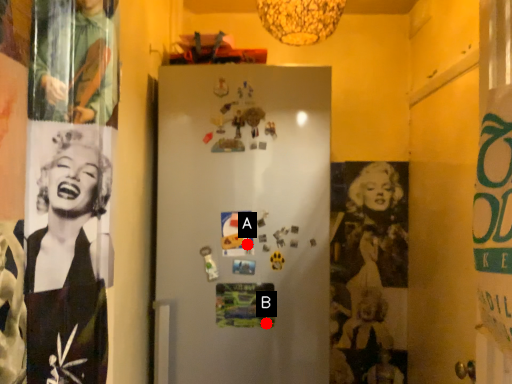
Question: Two points are circled on the image, labeled by A and B beside each circle. Which of the following is the closest to the observer?

Choices:
 (A) A is closer
 (B) B is closer

Answer: (B)